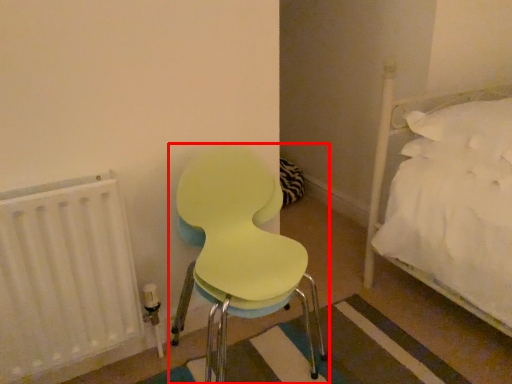
Question: In this image, where is chair (annotated by the red box) located relative to radiator?

Choices:
 (A) left
 (B) right

Answer: (B)